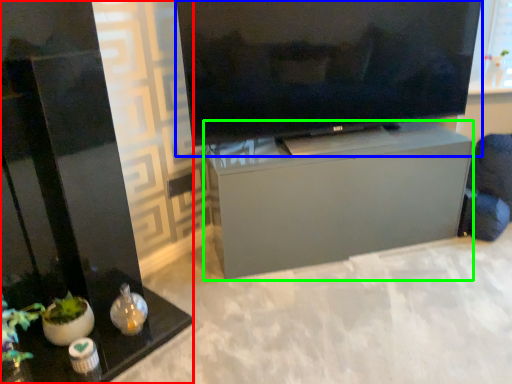
Question: Based on their relative distances, which object is farther from furniture (highlighted by a red box)? Choose from television (highlighted by a blue box) and furniture (highlighted by a green box).

Choices:
 (A) television
 (B) furniture

Answer: (A)